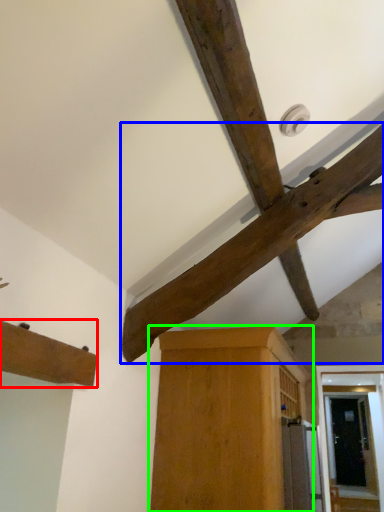
Question: Which object is the farthest from cabinetry (highlighted by a red box)? Choose among these: beam (highlighted by a blue box) or cabinetry (highlighted by a green box).

Choices:
 (A) beam
 (B) cabinetry

Answer: (B)